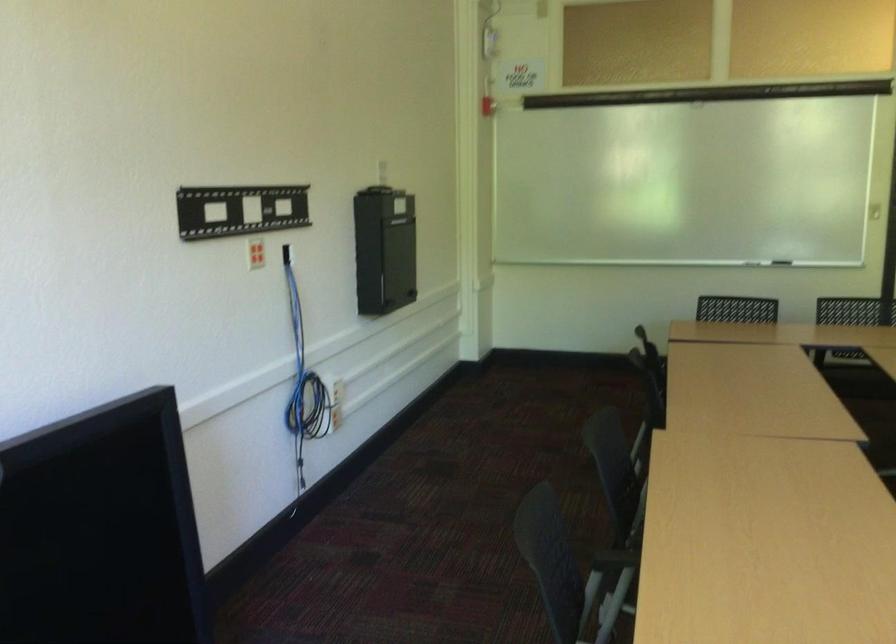
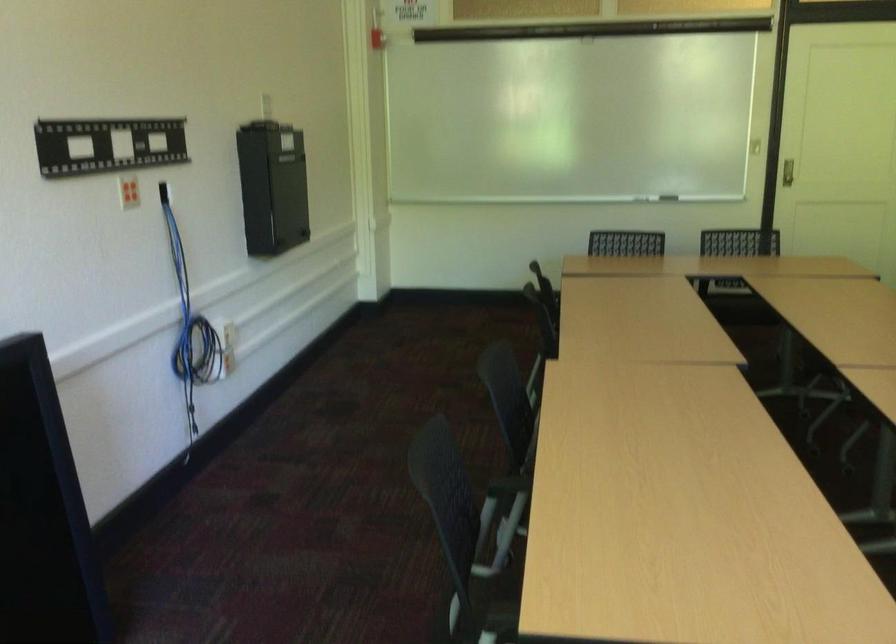
The point at (x=487, y=104) is marked in the first image. Where is the corresponding point in the second image?

(375, 38)